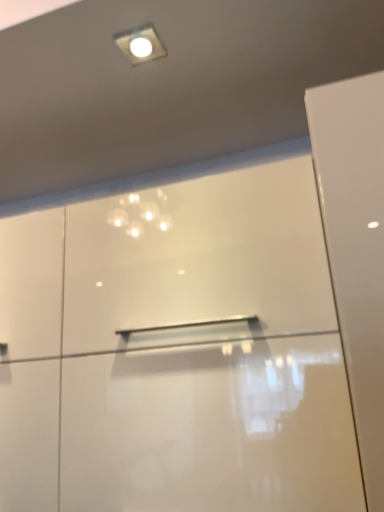
This screenshot has width=384, height=512. Identify the location of vacant space in front of white glossy droplight at upper center. (132, 15).